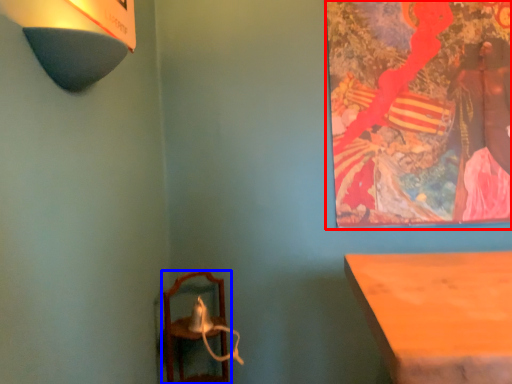
Question: Which object is closer to the camera taking this photo, picture frame (highlighted by a red box) or furniture (highlighted by a blue box)?

Choices:
 (A) picture frame
 (B) furniture

Answer: (B)